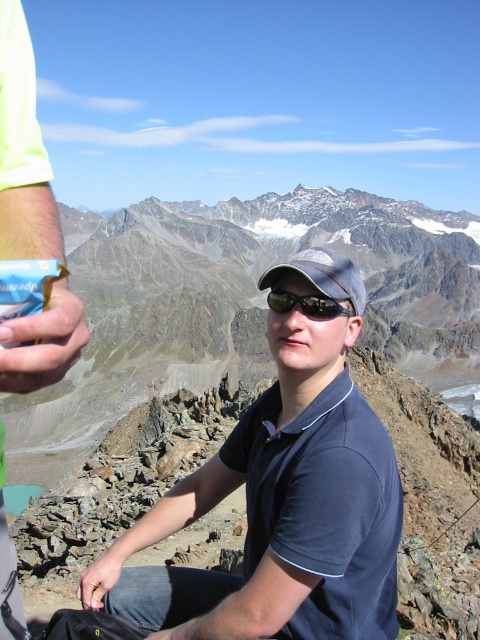
Question: Is dark gray fabric baseball cap at center thinner than black reflective sunglasses at center?

Choices:
 (A) yes
 (B) no

Answer: (B)

Question: Estimate the real-world distances between objects in this image. Which object is closer to the black reflective sunglasses at center?

Choices:
 (A) dark blue shirt at center
 (B) gray rocky mountain at center

Answer: (A)

Question: Is dark blue shirt at center above dark gray fabric baseball cap at center?

Choices:
 (A) yes
 (B) no

Answer: (B)

Question: Can you confirm if gray rocky mountain at center is thinner than black reflective sunglasses at center?

Choices:
 (A) yes
 (B) no

Answer: (B)

Question: Estimate the real-world distances between objects in this image. Which object is farther from the dark blue shirt at center?

Choices:
 (A) black reflective sunglasses at center
 (B) gray rocky mountain at center
 (C) dark gray fabric baseball cap at center

Answer: (B)

Question: Which object appears closest to the camera in this image?

Choices:
 (A) dark blue shirt at center
 (B) black reflective sunglasses at center

Answer: (A)